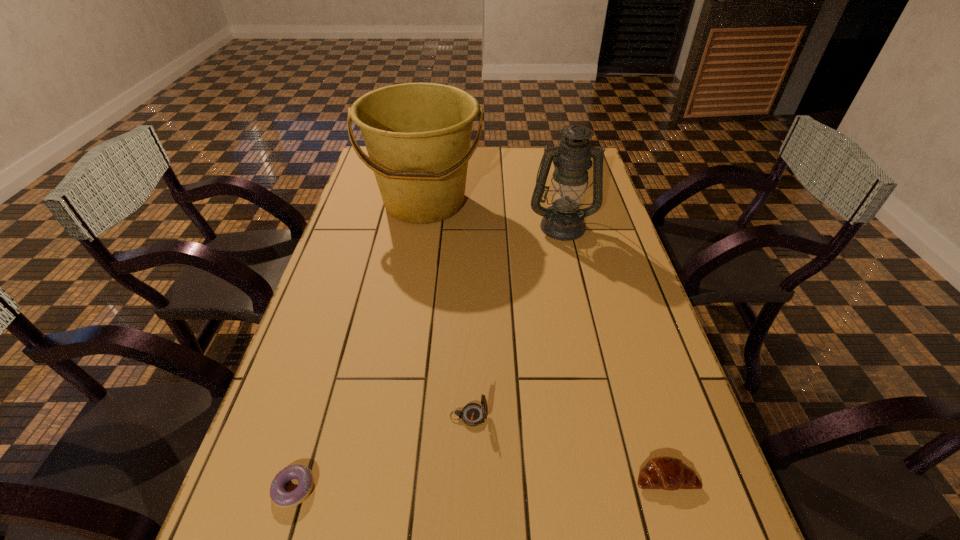
At what (x,y) coordinates should I click in order to perform the action: click on vacant space that is in between the oil lamp and the doughnut. Please return your answer as a coordinate pair (x, y). The width and height of the screenshot is (960, 540). Looking at the image, I should click on (428, 357).

Where is `vacant space in between the third shortest object and the doughnut`? The height and width of the screenshot is (540, 960). vacant space in between the third shortest object and the doughnut is located at coordinates click(x=381, y=453).

Locate an element on the screen. vacant space that's between the oil lamp and the doughnut is located at coordinates (428, 357).

The image size is (960, 540). In order to click on unoccupied area between the bucket and the doughnut in this screenshot , I will do `click(359, 346)`.

Where is `empty space that is in between the crescent roll and the shortest object`? The image size is (960, 540). empty space that is in between the crescent roll and the shortest object is located at coordinates (479, 483).

Identify the location of vacant space that is in between the third nearest object and the fourth tallest object. (567, 447).

The image size is (960, 540). What are the coordinates of `vacant space that is in between the third nearest object and the shortest object` in the screenshot? It's located at (381, 453).

Identify the location of vacant region between the compass and the bucket. (446, 309).

This screenshot has height=540, width=960. In order to click on vacant space that is in between the doughnut and the third tallest object in this screenshot , I will do `click(381, 453)`.

At what (x,y) coordinates should I click in order to perform the action: click on free space between the oil lamp and the shortest object. Please return your answer as a coordinate pair (x, y). Looking at the image, I should click on (428, 357).